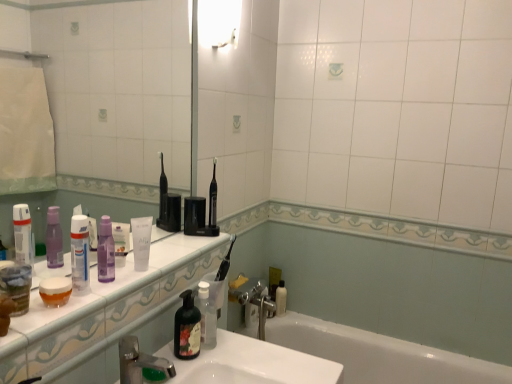
Question: Would you say white matte tube at center, positioned as the 4th toiletry in right-to-left order, is to the left or to the right of white glossy bathtub at lower center in the picture?

Choices:
 (A) right
 (B) left

Answer: (B)

Question: Does point (141, 248) appear closer or farther from the camera than point (311, 339)?

Choices:
 (A) closer
 (B) farther

Answer: (A)

Question: Which object is positioned farthest from the translucent plastic jar at lower left, which ranks as the 1th mouthwash in left-to-right order?

Choices:
 (A) white glossy sink at lower center
 (B) transparent plastic mirror at upper left
 (C) white glossy light fixture at upper center
 (D) transparent plastic bottle at left, which ranks as the 5th toiletry in right-to-left order
 (E) silver metallic faucet at lower center

Answer: (B)

Question: Considering the real-world distances, which object is closest to the transparent plastic mirror at upper left?

Choices:
 (A) white glossy sink at lower center
 (B) green matte soap dispenser at center, arranged as the third toiletry when viewed from the back
 (C) white glossy countertop at lower left
 (D) white glossy light fixture at upper center
 (E) white glossy bathtub at lower center

Answer: (D)